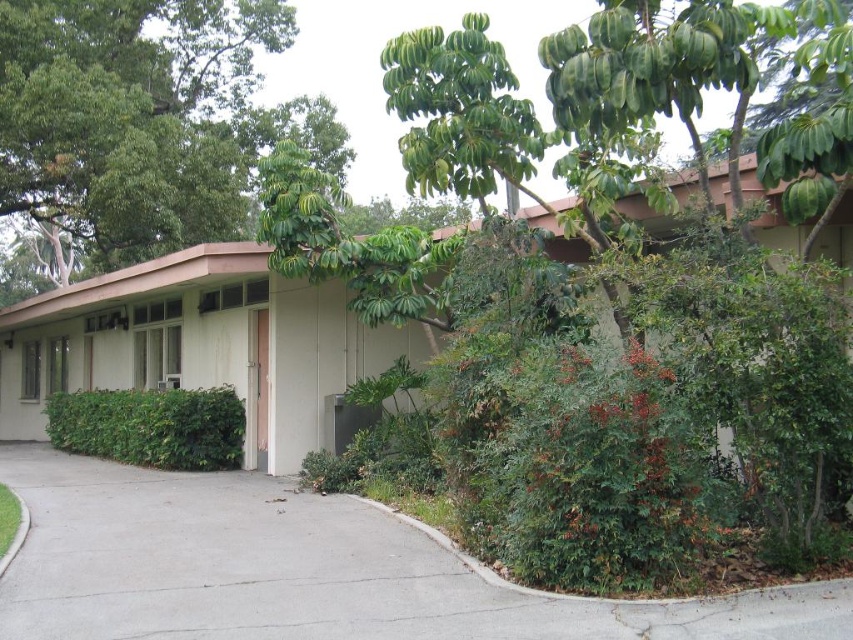
Who is more distant from viewer, (x=422, y=552) or (x=154, y=436)?

Point (x=154, y=436)

The width and height of the screenshot is (853, 640). In order to click on gray concrete driveway at lower left in this screenshot , I will do `click(305, 570)`.

Is green leafy tree at upper left closer to camera compared to green leafy bush at lower left?

No.

What do you see at coordinates (142, 122) in the screenshot? Image resolution: width=853 pixels, height=640 pixels. I see `green leafy tree at upper left` at bounding box center [142, 122].

The height and width of the screenshot is (640, 853). What are the coordinates of `green leafy tree at upper left` in the screenshot? It's located at (142, 122).

This screenshot has height=640, width=853. Describe the element at coordinates (305, 570) in the screenshot. I see `gray concrete driveway at lower left` at that location.

Does point (177, 611) come behind point (135, 150)?

No, it is in front of (135, 150).

Where is `gray concrete driveway at lower left`? The image size is (853, 640). gray concrete driveway at lower left is located at coordinates (305, 570).